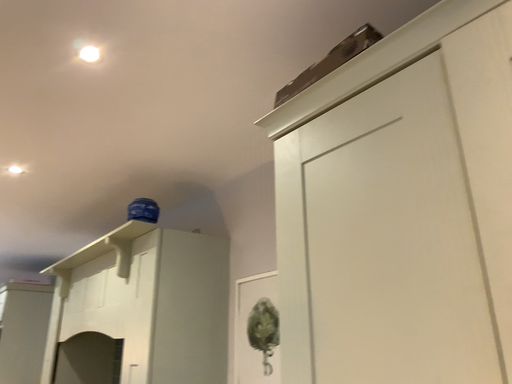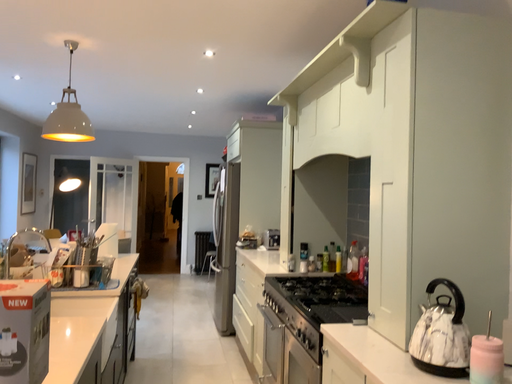
Question: Which way did the camera rotate in the video?

Choices:
 (A) rotated left
 (B) rotated right

Answer: (A)